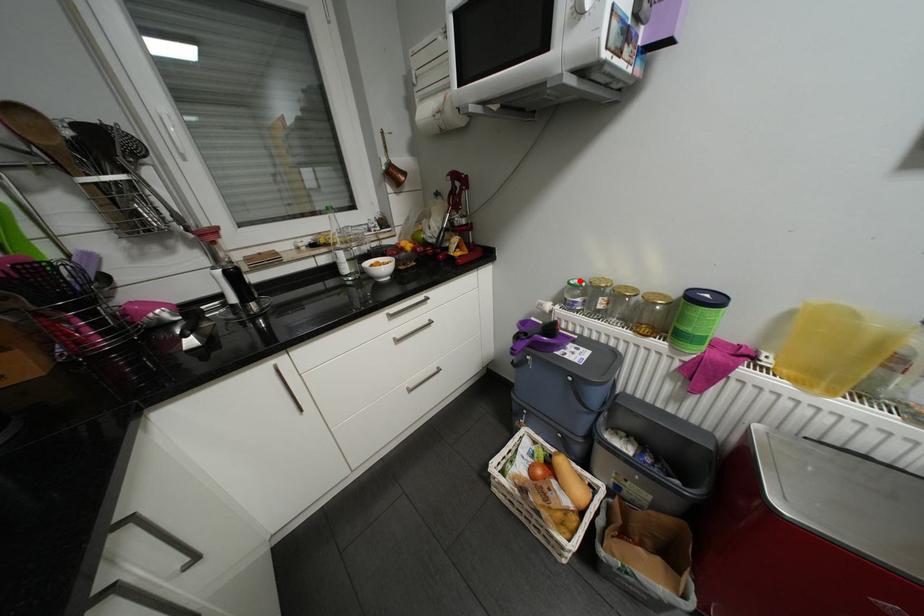
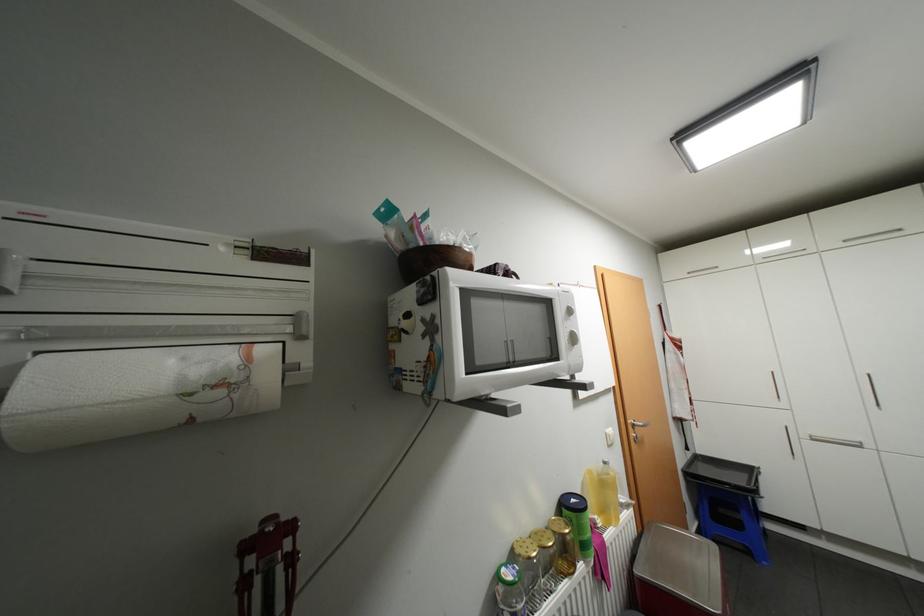
The point at the highlighted location is marked in the first image. Where is the corresponding point in the second image?

(518, 576)